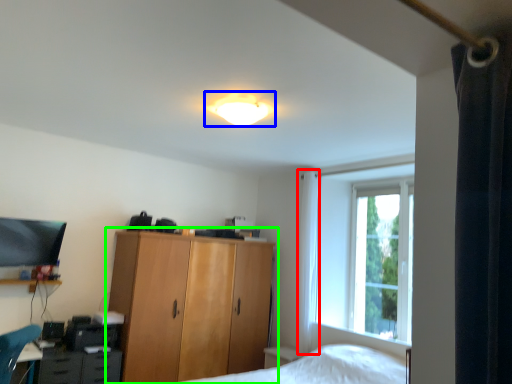
Question: Which object is positioned closest to curtain (highlighted by a red box)? Select from lamp (highlighted by a blue box) and cupboard (highlighted by a green box).

Choices:
 (A) lamp
 (B) cupboard

Answer: (B)